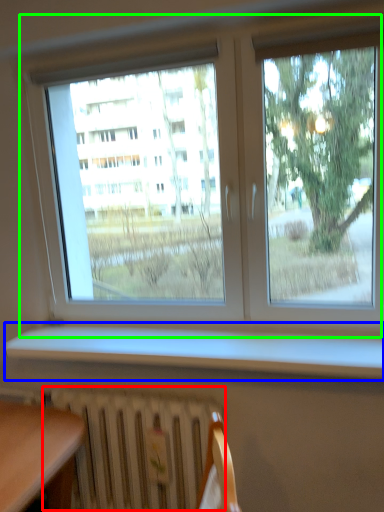
Question: Which object is the closest to the radiator (highlighted by a red box)? Choose among these: window sill (highlighted by a blue box) or window (highlighted by a green box).

Choices:
 (A) window sill
 (B) window

Answer: (A)